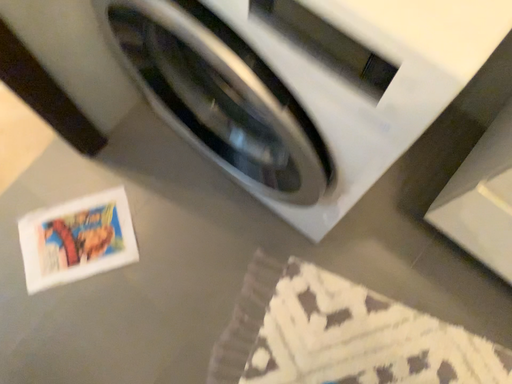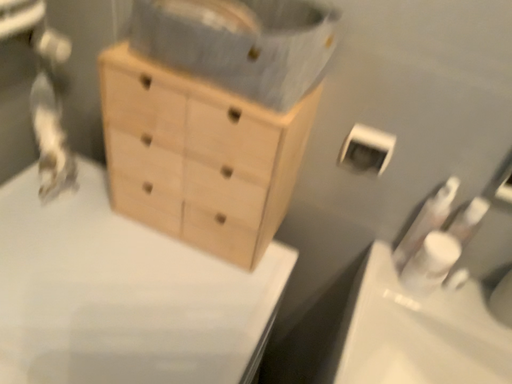
Question: Which way did the camera rotate in the video?

Choices:
 (A) rotated upward
 (B) rotated downward

Answer: (A)